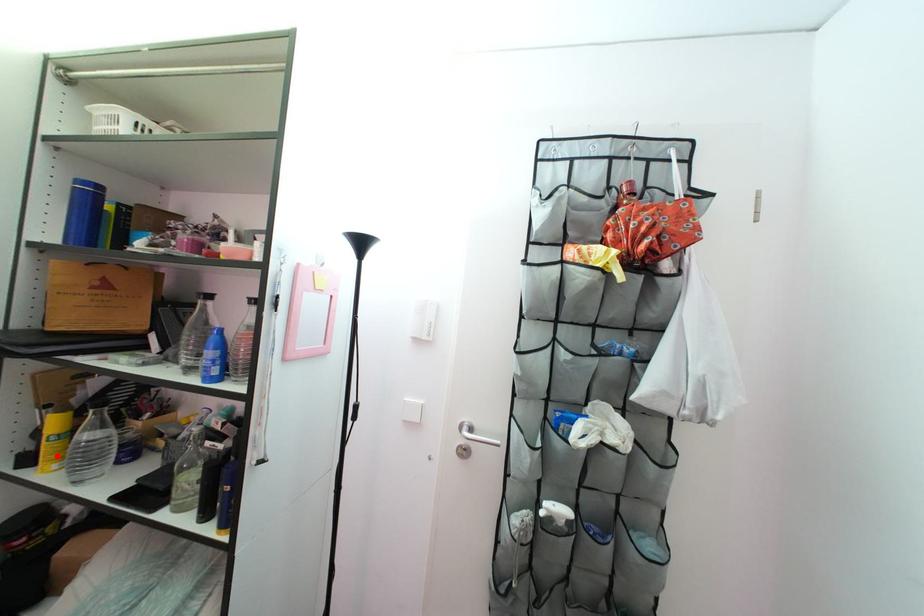
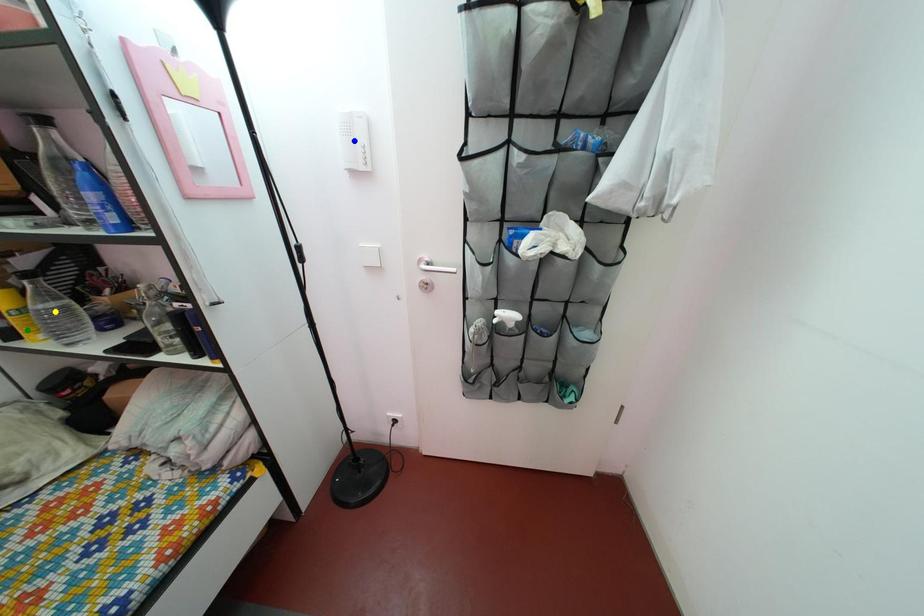
Question: I am providing you with two images of the same scene from different viewpoints. A red point is marked on the first image. You are given multiple points on the second image. Which mark in image 2 goes with the point in image 1?

Choices:
 (A) yellow point
 (B) green point
 (C) blue point

Answer: (B)